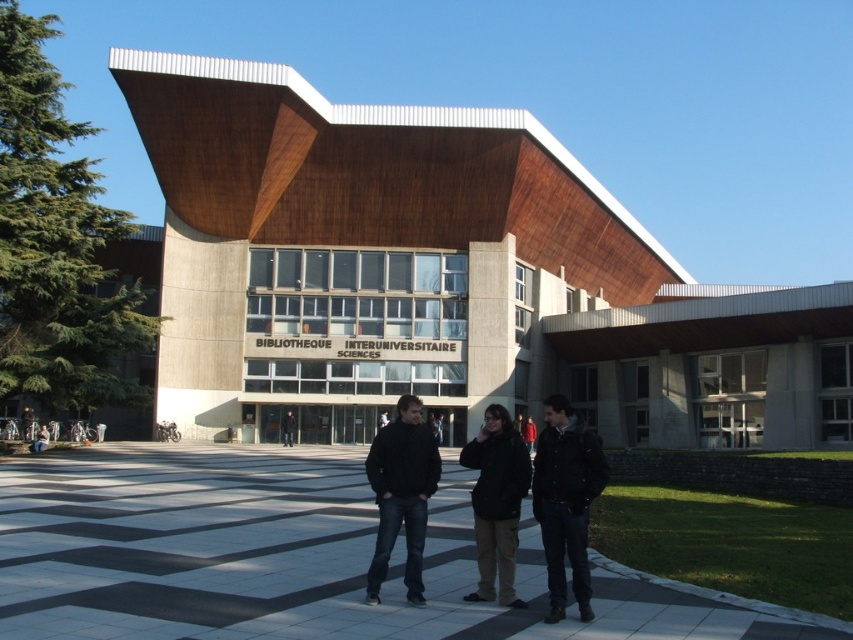
You are a photographer standing at the entrance of the BIBLIOTHEQUE INTERUNIVERSITAIRE SCIENCES. You want to take a photo of the dark blue jeans at center. Where should you position yourself to capture the jeans in the center of your camera frame?

Position yourself directly in front of the dark blue jeans at center, aligning the camera frame so the jeans are centered at the coordinates provided.

You are a photographer trying to capture a group photo of the black matte jacket at center and the dark brown leather jacket at center. Since you want to ensure both jackets are fully visible in the frame, which jacket should you focus on to avoid cropping the top of the taller one?

The dark brown leather jacket at center is taller than the black matte jacket at center, so you should focus on the dark brown leather jacket at center to avoid cropping its top.

You are standing in front of the Inter University Library Sciences building and notice two points marked on the ground. The first point is at coordinates point (503, 564) and the second is at point (488, 438). If you want to walk towards the library entrance, which point should you step on first to be closer to the entrance?

Point (503, 564) is closer to the viewer than point (488, 438), so stepping on point (503, 564) first would place you closer to the library entrance.